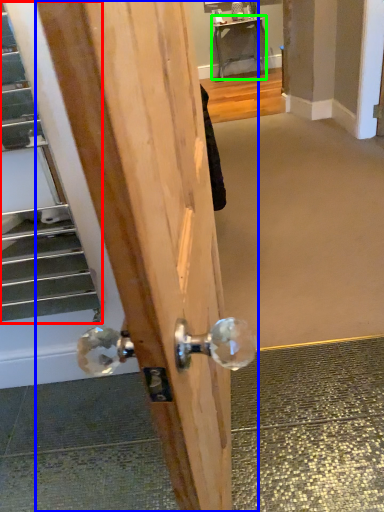
Question: Which is nearer to the escalator (highlighted by a red box)? door (highlighted by a blue box) or table (highlighted by a green box).

Choices:
 (A) door
 (B) table

Answer: (A)